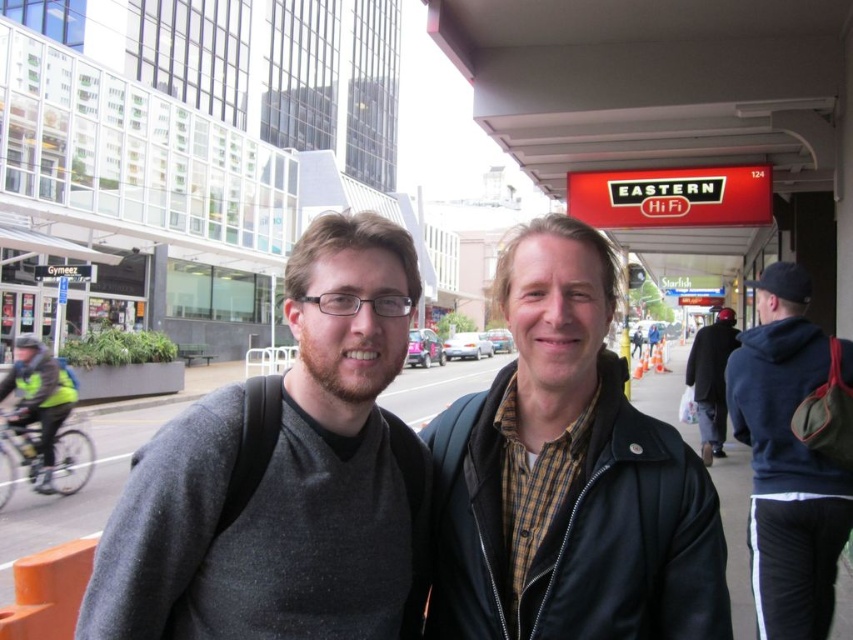
Question: Can you confirm if navy blue hoodie at right is positioned to the right of dark blue jacket at center?

Choices:
 (A) no
 (B) yes

Answer: (A)

Question: Which object is the closest to the dark gray sweater at center?

Choices:
 (A) navy blue hoodie at right
 (B) black leather jacket at center
 (C) gray asphalt at center
 (D) dark blue jacket at center

Answer: (B)

Question: Which of the following is the closest to the observer?

Choices:
 (A) (767, 465)
 (B) (718, 456)

Answer: (A)

Question: Is black leather jacket at center below gray asphalt at center?

Choices:
 (A) no
 (B) yes

Answer: (A)

Question: Can you confirm if navy blue hoodie at right is smaller than gray asphalt at center?

Choices:
 (A) yes
 (B) no

Answer: (A)

Question: Among these objects, which one is farthest from the camera?

Choices:
 (A) dark blue jacket at center
 (B) dark gray sweater at center
 (C) black leather jacket at center

Answer: (A)